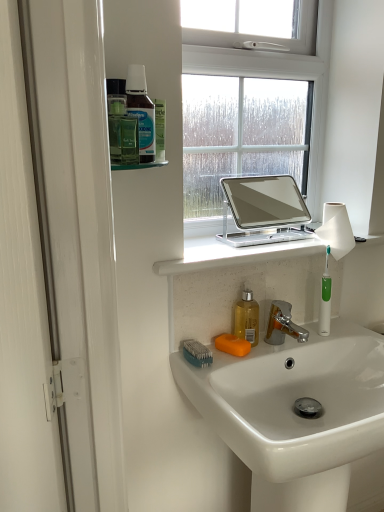
Find the location of a particular element. free spot in front of orange matte soap at sink is located at coordinates (231, 366).